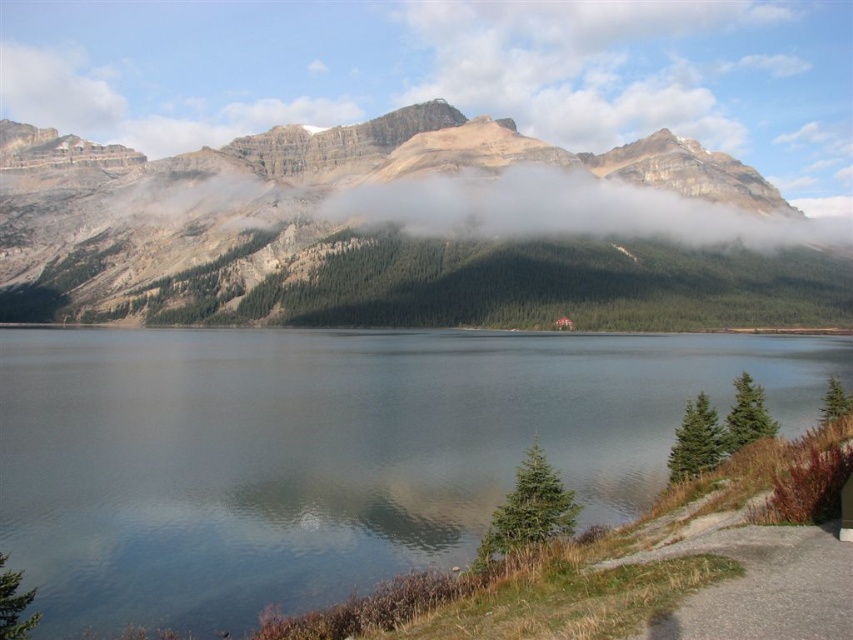
You are standing at the edge of the water in the serene landscape scene. There is a point marked at coordinates [328,452]. Can you confirm if this point corresponds to the location of the clear water at center?

Yes, the clear water at center is located at point [328,452], so the coordinates correspond to its location.

You are planning to build a small boat dock on the water. Given the sizes of the clear water at center and the rocky mountain at center, which one would be more challenging to construct the dock near? Explain your reasoning.

The rocky mountain at center is larger than the clear water at center, so constructing a dock near the rocky mountain at center would be more challenging due to its size and the potential rocky terrain, making it harder to build compared to the smaller clear water at center.

You are standing at the edge of the clear water at center and looking towards the rocky mountain at center. Which object is closer to you?

The clear water at center is closer to you than the rocky mountain at center.